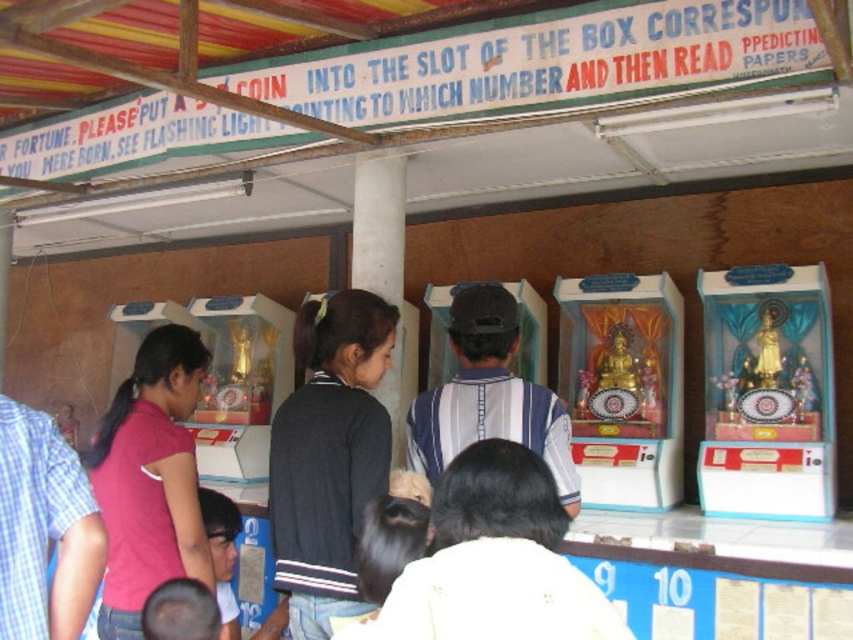
Which of these two, gold metallic statue at center right or gold shiny statue at center, stands taller?

With more height is gold metallic statue at center right.

Does gold metallic statue at center right appear on the right side of gold shiny statue at center?

Correct, you'll find gold metallic statue at center right to the right of gold shiny statue at center.

Between point (750, 445) and point (608, 369), which one is positioned behind?

Point (608, 369)

Identify the location of gold metallic statue at center right. (767, 394).

Which is more to the right, gold shiny statue at center or pink fabric shirt at left?

From the viewer's perspective, gold shiny statue at center appears more on the right side.

Who is more distant from viewer, (611, 378) or (138, 547)?

The point (611, 378) is more distant.

Who is more forward, (596,289) or (146,461)?

Point (146,461)

Locate an element on the screen. This screenshot has height=640, width=853. gold shiny statue at center is located at coordinates (624, 387).

Is gold shiny statue at center shorter than striped fabric shirt at center?

No, gold shiny statue at center is not shorter than striped fabric shirt at center.

Is point (648, 396) positioned behind point (532, 433)?

That is True.

The height and width of the screenshot is (640, 853). I want to click on gold shiny statue at center, so click(624, 387).